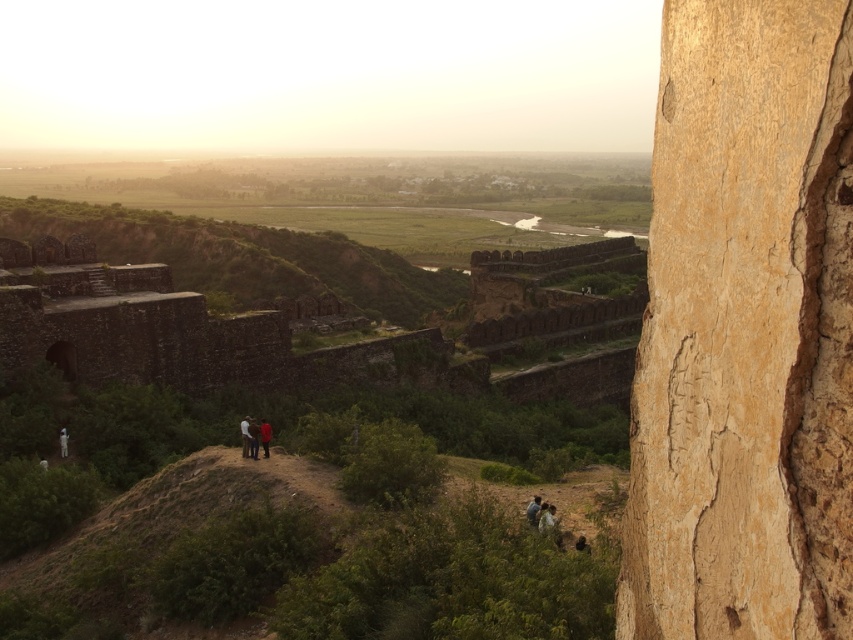
Looking at this image, you are a hiker standing on the hilltop and see the smooth beige rock at right and the dark blue shirt at center. Which object is larger in size?

The smooth beige rock at right is bigger than the dark blue shirt at center.

You are standing on the hilltop and notice the smooth beige rock at right and the dark blue jeans at center. Which object is positioned farther to the east?

The smooth beige rock at right is to the right of dark blue jeans at center, so it is positioned farther to the east.

You are standing on a hill overlooking a valley. You notice a point marked at coordinates (746, 330). What is the object located at that point?

The point at coordinates (746, 330) marks a smooth beige rock at the right.